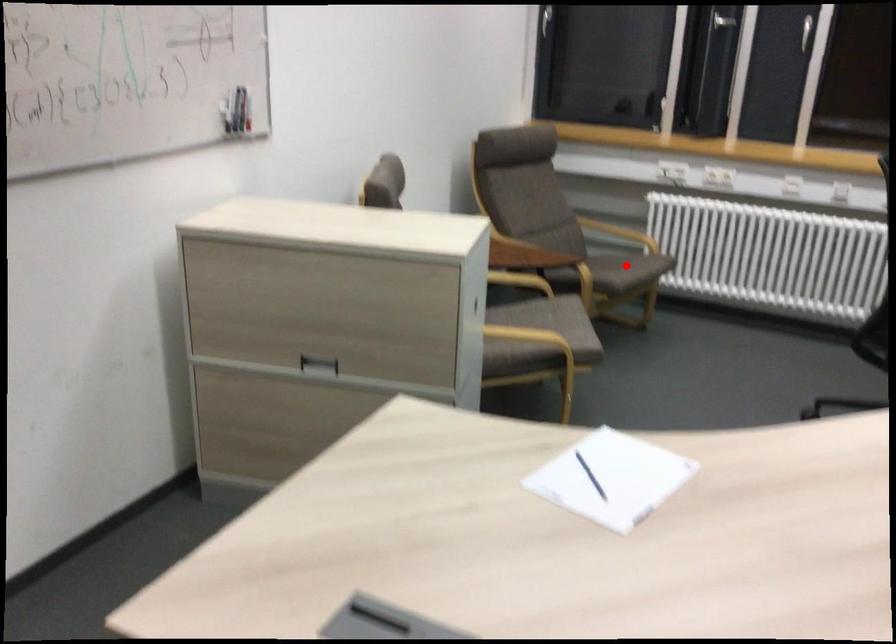
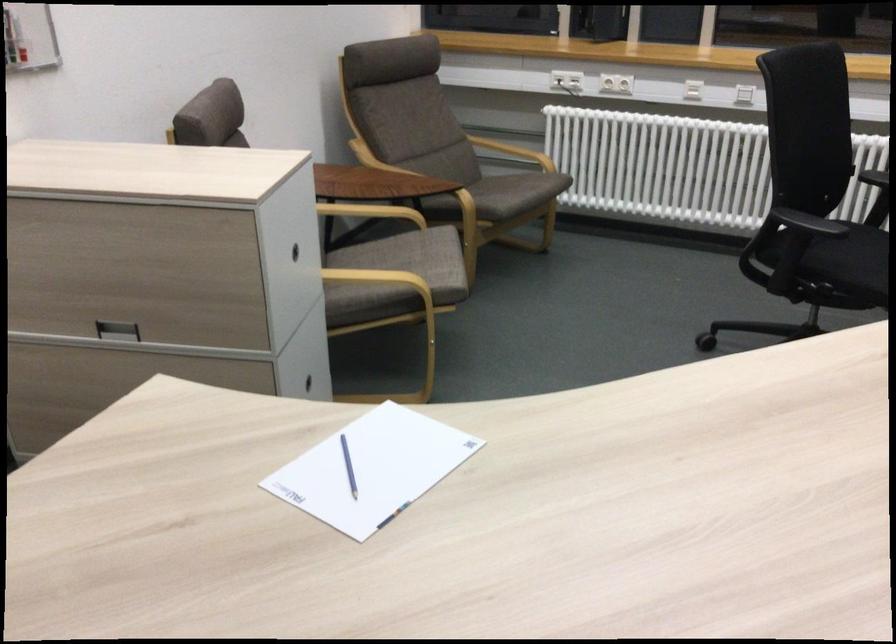
Where in the second image is the point corresponding to the highlighted location from the first image?

(510, 191)